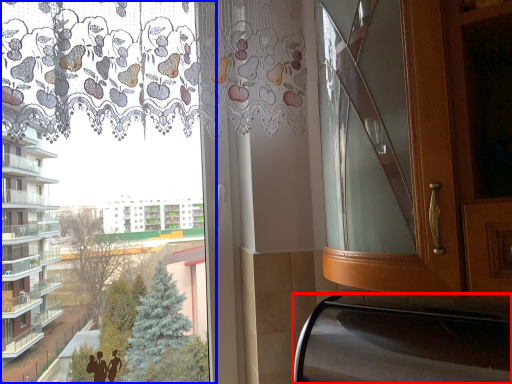
Question: Which point is closer to the camera, oven (highlighted by a red box) or bay window (highlighted by a blue box)?

Choices:
 (A) oven
 (B) bay window

Answer: (A)